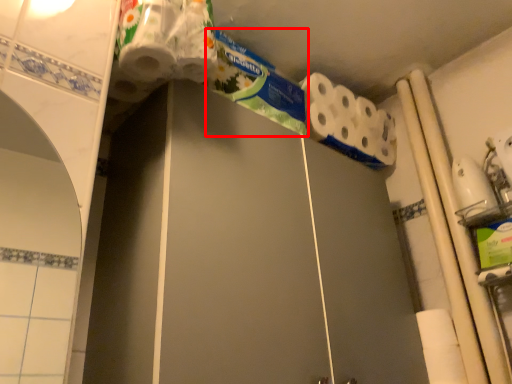
Question: From the image's perspective, what is the correct spatial positioning of toothpaste (annotated by the red box) in reference to toilet paper?

Choices:
 (A) above
 (B) below

Answer: (A)